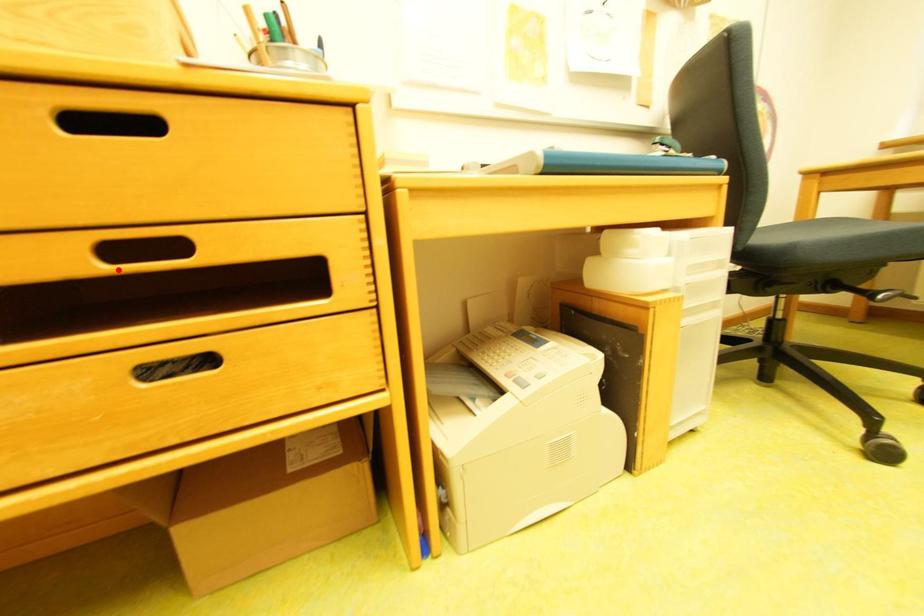
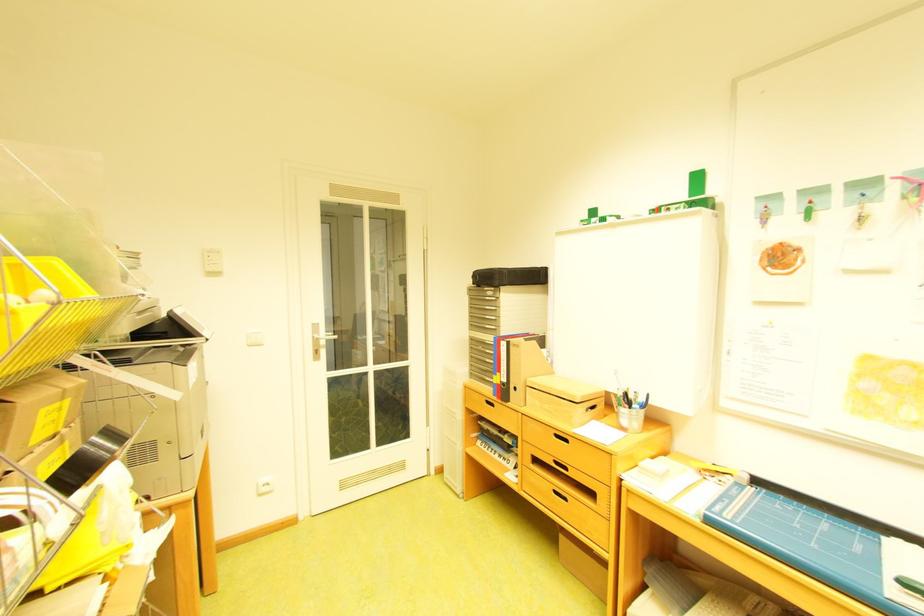
Find the pixel in the second image that matches the highlighted location in the first image.

(565, 467)